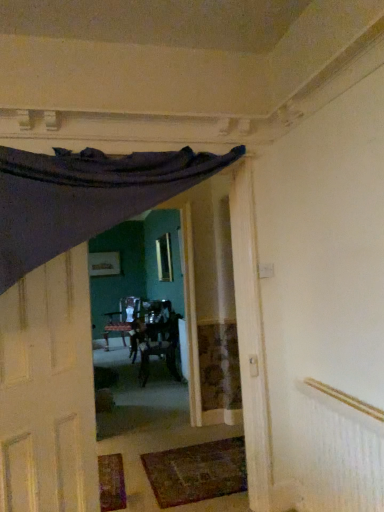
Question: Is dark brown woven mat at lower center further to the viewer compared to white textured radiator at upper right?

Choices:
 (A) yes
 (B) no

Answer: (A)

Question: Considering the relative sizes of dark brown woven mat at lower center and white textured radiator at upper right in the image provided, is dark brown woven mat at lower center taller than white textured radiator at upper right?

Choices:
 (A) yes
 (B) no

Answer: (B)

Question: Is dark brown woven mat at lower center positioned far away from white textured radiator at upper right?

Choices:
 (A) no
 (B) yes

Answer: (B)

Question: From a real-world perspective, is dark brown woven mat at lower center located beneath white textured radiator at upper right?

Choices:
 (A) no
 (B) yes

Answer: (B)

Question: Could you tell me if dark brown woven mat at lower center is turned towards white textured radiator at upper right?

Choices:
 (A) yes
 (B) no

Answer: (B)

Question: Is clear glass window at center to the left or to the right of matte white door at left in the image?

Choices:
 (A) right
 (B) left

Answer: (A)

Question: From a real-world perspective, is clear glass window at center positioned above or below matte white door at left?

Choices:
 (A) below
 (B) above

Answer: (B)

Question: Is clear glass window at center wider or thinner than matte white door at left?

Choices:
 (A) thin
 (B) wide

Answer: (A)

Question: Choose the correct answer: Is clear glass window at center inside matte white door at left or outside it?

Choices:
 (A) inside
 (B) outside

Answer: (B)

Question: Considering the positions of point (157, 249) and point (175, 451), is point (157, 249) closer or farther from the camera than point (175, 451)?

Choices:
 (A) closer
 (B) farther

Answer: (B)

Question: Based on their positions, is clear glass window at center located to the left or right of dark brown woven mat at lower center?

Choices:
 (A) right
 (B) left

Answer: (B)

Question: From the image's perspective, relative to dark brown woven mat at lower center, is clear glass window at center above or below?

Choices:
 (A) below
 (B) above

Answer: (B)

Question: Looking at the image, does clear glass window at center seem bigger or smaller compared to dark brown woven mat at lower center?

Choices:
 (A) big
 (B) small

Answer: (A)

Question: From the image's perspective, is matte white door at left located above or below wooden textured chair at center?

Choices:
 (A) above
 (B) below

Answer: (A)

Question: Is point (64, 439) closer or farther from the camera than point (167, 302)?

Choices:
 (A) farther
 (B) closer

Answer: (B)